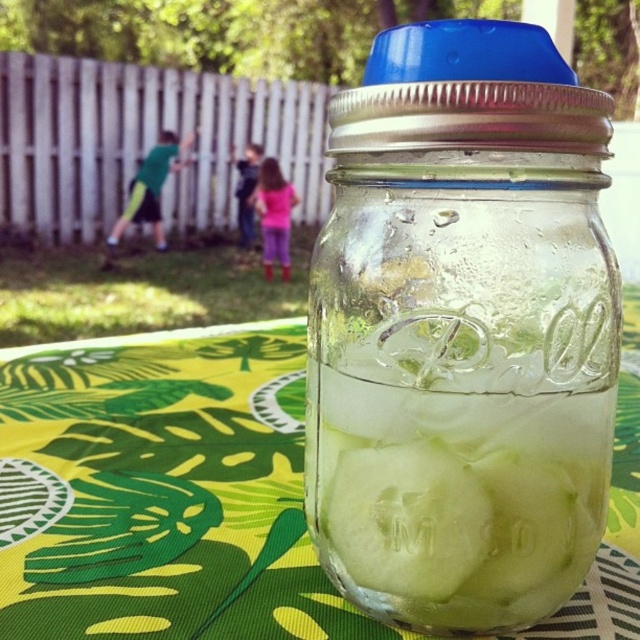
You are looking at the glass mason jar on the vibrant green tablecloth. There is a point marked at coordinates (454, 499). What does this point represent?

The point at coordinates (454, 499) indicates the clear glass ice at center.

You are at a backyard party and see a green translucent cucumber at center and a pink fabric pants at center. Which object is positioned to the right side?

The green translucent cucumber at center is positioned to the right of the pink fabric pants at center.